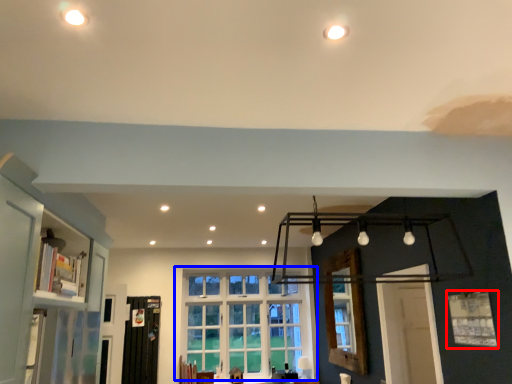
Question: Which of the following is the closest to the observer, window (highlighted by a red box) or window (highlighted by a blue box)?

Choices:
 (A) window
 (B) window

Answer: (A)